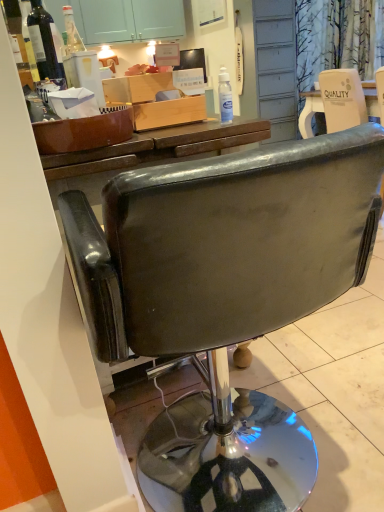
Where is `transparent plastic bottle at upper center, which is the first bottle from right to left`? This screenshot has height=512, width=384. transparent plastic bottle at upper center, which is the first bottle from right to left is located at coordinates (225, 96).

What is the approximate width of white paper bag at upper right?

24.25 inches.

This screenshot has width=384, height=512. What do you see at coordinates (154, 101) in the screenshot? I see `wooden box at center` at bounding box center [154, 101].

Describe the element at coordinates (225, 297) in the screenshot. I see `leather-like black chair at center` at that location.

At what (x,y) coordinates should I click in order to perform the action: click on transparent plastic bottle at upper center, which is the first bottle from right to left. Please return your answer as a coordinate pair (x, y). Looking at the image, I should click on tap(225, 96).

Is leather-like black chair at center not close to dark glass bottle at upper left, which is the 2th bottle in bottom-to-top order?

That's right, there is a large distance between leather-like black chair at center and dark glass bottle at upper left, which is the 2th bottle in bottom-to-top order.

Is dark glass bottle at upper left, which is the first bottle from top to bottom, at the back of leather-like black chair at center?

No, leather-like black chair at center is not facing the opposite direction of dark glass bottle at upper left, which is the first bottle from top to bottom.

Who is smaller, leather-like black chair at center or dark glass bottle at upper left, which is the first bottle in left-to-right order?

With smaller size is dark glass bottle at upper left, which is the first bottle in left-to-right order.

Does leather-like black chair at center have a greater height compared to dark glass bottle at upper left, which is the first bottle from top to bottom?

Indeed, leather-like black chair at center has a greater height compared to dark glass bottle at upper left, which is the first bottle from top to bottom.

Does transparent plastic bottle at upper center, placed as the second bottle when sorted from top to bottom, have a greater width compared to dark glass bottle at upper left, which is the first bottle from top to bottom?

Incorrect, the width of transparent plastic bottle at upper center, placed as the second bottle when sorted from top to bottom, does not surpass that of dark glass bottle at upper left, which is the first bottle from top to bottom.

Looking at this image, does transparent plastic bottle at upper center, marked as the first bottle in a bottom-to-top arrangement, have a lesser height compared to dark glass bottle at upper left, which is the second bottle in right-to-left order?

Indeed, transparent plastic bottle at upper center, marked as the first bottle in a bottom-to-top arrangement, has a lesser height compared to dark glass bottle at upper left, which is the second bottle in right-to-left order.

Which is more to the left, transparent plastic bottle at upper center, placed as the second bottle when sorted from top to bottom, or dark glass bottle at upper left, which is the second bottle in right-to-left order?

dark glass bottle at upper left, which is the second bottle in right-to-left order.

The width and height of the screenshot is (384, 512). I want to click on bottle in front of the transparent plastic bottle at upper center, positioned as the second bottle in left-to-right order, so click(x=45, y=42).

Is matte black television at upper center further to the viewer compared to wooden box at center?

Yes.

From the image's perspective, relative to wooden box at center, is matte black television at upper center above or below?

From the image's perspective, matte black television at upper center appears above wooden box at center.

Is matte black television at upper center to the left of wooden box at center from the viewer's perspective?

No, matte black television at upper center is not to the left of wooden box at center.

At what (x,y) coordinates should I click in order to perform the action: click on television above the wooden box at center (from a real-world perspective). Please return your answer as a coordinate pair (x, y). The height and width of the screenshot is (512, 384). Looking at the image, I should click on (192, 60).

Is point (199, 61) positioned after point (377, 111)?

No.

Which is more to the right, matte black television at upper center or white paper bag at upper right?

white paper bag at upper right is more to the right.

Where is `television above the white paper bag at upper right (from a real-world perspective)`? Image resolution: width=384 pixels, height=512 pixels. television above the white paper bag at upper right (from a real-world perspective) is located at coordinates (192, 60).

Is the surface of matte black television at upper center in direct contact with white paper bag at upper right?

matte black television at upper center is not next to white paper bag at upper right, and they're not touching.

Are dark glass bottle at upper left, which is the 2th bottle in bottom-to-top order, and wooden box at center making contact?

dark glass bottle at upper left, which is the 2th bottle in bottom-to-top order, and wooden box at center are clearly separated.

Is point (50, 51) closer or farther from the camera than point (146, 79)?

Clearly, point (50, 51) is more distant from the camera than point (146, 79).

Considering the sizes of objects dark glass bottle at upper left, which is the first bottle in left-to-right order, and wooden box at center in the image provided, who is taller, dark glass bottle at upper left, which is the first bottle in left-to-right order, or wooden box at center?

dark glass bottle at upper left, which is the first bottle in left-to-right order, is taller.

Is dark glass bottle at upper left, which is the 2th bottle in bottom-to-top order, aimed at wooden box at center?

No, dark glass bottle at upper left, which is the 2th bottle in bottom-to-top order, is not aimed at wooden box at center.

This screenshot has width=384, height=512. What are the coordinates of `box in front of the white paper bag at upper right` in the screenshot? It's located at (154, 101).

Can you see wooden box at center touching white paper bag at upper right?

They are not placed beside each other.

From a real-world perspective, between wooden box at center and white paper bag at upper right, who is vertically higher?

From a 3D spatial view, wooden box at center is above.

Between wooden box at center and white paper bag at upper right, which one has larger width?

Wider between the two is white paper bag at upper right.

Is wooden box at center facing towards leather-like black chair at center?

No, wooden box at center is not facing towards leather-like black chair at center.

Which object is wider, wooden box at center or leather-like black chair at center?

leather-like black chair at center is wider.

Considering the sizes of objects wooden box at center and leather-like black chair at center in the image provided, who is bigger, wooden box at center or leather-like black chair at center?

With larger size is leather-like black chair at center.

Does wooden box at center lie behind leather-like black chair at center?

Yes, it is behind leather-like black chair at center.

Starting from the leather-like black chair at center, which bottle is the 1st one behind? Please provide its 2D coordinates.

[(45, 42)]

Where is `bottle above the transparent plastic bottle at upper center, marked as the first bottle in a bottom-to-top arrangement (from a real-world perspective)`? The height and width of the screenshot is (512, 384). bottle above the transparent plastic bottle at upper center, marked as the first bottle in a bottom-to-top arrangement (from a real-world perspective) is located at coordinates (45, 42).

Which object lies further to the anchor point dark glass bottle at upper left, which is the first bottle in left-to-right order, white paper bag at upper right or transparent plastic bottle at upper center, marked as the first bottle in a bottom-to-top arrangement?

Based on the image, white paper bag at upper right appears to be further to dark glass bottle at upper left, which is the first bottle in left-to-right order.

From the image, which object appears to be farther from transparent plastic bottle at upper center, which is the first bottle from right to left, wooden box at center or dark glass bottle at upper left, which is the second bottle in right-to-left order?

dark glass bottle at upper left, which is the second bottle in right-to-left order, lies further to transparent plastic bottle at upper center, which is the first bottle from right to left, than the other object.

Looking at the image, which one is located further to white paper bag at upper right, leather-like black chair at center or matte black television at upper center?

leather-like black chair at center is positioned further to the anchor white paper bag at upper right.

From the image, which object appears to be nearer to wooden box at center, matte black television at upper center or dark glass bottle at upper left, which is the first bottle in left-to-right order?

Among the two, matte black television at upper center is located nearer to wooden box at center.

From the image, which object appears to be nearer to transparent plastic bottle at upper center, placed as the second bottle when sorted from top to bottom, leather-like black chair at center or matte black television at upper center?

Among the two, matte black television at upper center is located nearer to transparent plastic bottle at upper center, placed as the second bottle when sorted from top to bottom.

Estimate the real-world distances between objects in this image. Which object is closer to wooden box at center, transparent plastic bottle at upper center, marked as the first bottle in a bottom-to-top arrangement, or white paper bag at upper right?

transparent plastic bottle at upper center, marked as the first bottle in a bottom-to-top arrangement, is closer to wooden box at center.

Consider the image. When comparing their distances from dark glass bottle at upper left, which is the 2th bottle in bottom-to-top order, does wooden box at center or leather-like black chair at center seem further?

Based on the image, leather-like black chair at center appears to be further to dark glass bottle at upper left, which is the 2th bottle in bottom-to-top order.

Which object lies further to the anchor point transparent plastic bottle at upper center, marked as the first bottle in a bottom-to-top arrangement, leather-like black chair at center or dark glass bottle at upper left, which is the second bottle in right-to-left order?

leather-like black chair at center.

I want to click on box located between dark glass bottle at upper left, which is the first bottle from top to bottom, and matte black television at upper center in the depth direction, so click(x=154, y=101).

You are a GUI agent. You are given a task and a screenshot of the screen. Output one action in this format:
    pyautogui.click(x=<x>, y=<y>)
    Task: Click on the box situated between dark glass bottle at upper left, which is the first bottle from top to bottom, and transparent plastic bottle at upper center, marked as the first bottle in a bottom-to-top arrangement, from left to right
    
    Given the screenshot: What is the action you would take?
    pyautogui.click(x=154, y=101)

Locate an element on the screen. The height and width of the screenshot is (512, 384). desk positioned between wooden box at center and matte black television at upper center from near to far is located at coordinates (309, 112).

Find the location of a particular element. The height and width of the screenshot is (512, 384). bottle between dark glass bottle at upper left, which is the first bottle in left-to-right order, and white paper bag at upper right from front to back is located at coordinates (225, 96).